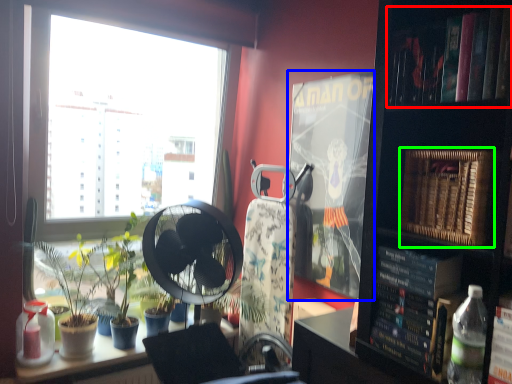
Question: Which object is positioned farthest from book (highlighted by a red box)? Select from paperback book (highlighted by a blue box) and paperback book (highlighted by a green box).

Choices:
 (A) paperback book
 (B) paperback book

Answer: (A)